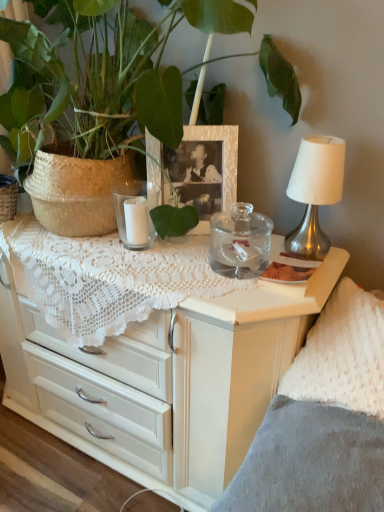
What is the approximate width of white lace chest of drawers at upper center?

The width of white lace chest of drawers at upper center is 19.21 inches.

Where is `green woven basket at upper left`? green woven basket at upper left is located at coordinates (102, 74).

This screenshot has height=512, width=384. I want to click on silver metallic table lamp at upper right, so click(315, 192).

This screenshot has height=512, width=384. Describe the element at coordinates (196, 170) in the screenshot. I see `white textured picture frame at center` at that location.

Where is `transparent glass jar at center, positioned as the 1th candle holder in right-to-left order`? The image size is (384, 512). transparent glass jar at center, positioned as the 1th candle holder in right-to-left order is located at coordinates (239, 241).

Is white glass candle at center, placed as the second candle holder when sorted from right to left, further to camera compared to white textured picture frame at center?

No, white glass candle at center, placed as the second candle holder when sorted from right to left, is closer to the viewer.

From a real-world perspective, is white glass candle at center, placed as the second candle holder when sorted from right to left, located higher than white textured picture frame at center?

No.

Looking at this image, which object is positioned more to the left, white glass candle at center, placed as the second candle holder when sorted from right to left, or white textured picture frame at center?

white glass candle at center, placed as the second candle holder when sorted from right to left.

Is white textured picture frame at center at the back of white glass candle at center, acting as the 1th candle holder starting from the left?

Absolutely, white glass candle at center, acting as the 1th candle holder starting from the left, is directed away from white textured picture frame at center.

In order to click on pillow above the white lace chest of drawers at upper center (from a real-world perspective) in this screenshot , I will do `click(343, 354)`.

Is white lace chest of drawers at upper center aimed at white fluffy pillow at right?

No, white lace chest of drawers at upper center is not turned towards white fluffy pillow at right.

Is white lace chest of drawers at upper center not close to white fluffy pillow at right?

No, white lace chest of drawers at upper center is not far from white fluffy pillow at right.

Would you say gray fabric at lower right is outside white glass candle at center, acting as the 1th candle holder starting from the left?

Indeed, gray fabric at lower right is completely outside white glass candle at center, acting as the 1th candle holder starting from the left.

Considering the positions of point (298, 507) and point (143, 246), is point (298, 507) closer or farther from the camera than point (143, 246)?

Point (298, 507) appears to be closer to the viewer than point (143, 246).

What's the angular difference between gray fabric at lower right and white glass candle at center, placed as the second candle holder when sorted from right to left,'s facing directions?

1.29 degrees.

Would you consider gray fabric at lower right to be distant from white glass candle at center, acting as the 1th candle holder starting from the left?

They are positioned close to each other.

Is white textured picture frame at center next to white glass candle at center, placed as the second candle holder when sorted from right to left, and touching it?

No, white textured picture frame at center is not next to white glass candle at center, placed as the second candle holder when sorted from right to left.

Considering the sizes of white textured picture frame at center and white glass candle at center, acting as the 1th candle holder starting from the left, in the image, is white textured picture frame at center taller or shorter than white glass candle at center, acting as the 1th candle holder starting from the left,?

white textured picture frame at center is taller than white glass candle at center, acting as the 1th candle holder starting from the left.

Consider the image. Measure the distance from white textured picture frame at center to white glass candle at center, placed as the second candle holder when sorted from right to left.

They are 5.84 inches apart.

Is white textured picture frame at center oriented away from white glass candle at center, placed as the second candle holder when sorted from right to left?

No, white textured picture frame at center is not facing the opposite direction of white glass candle at center, placed as the second candle holder when sorted from right to left.

Is transparent glass jar at center, positioned as the 1th candle holder in right-to-left order, aimed at silver metallic table lamp at upper right?

No, transparent glass jar at center, positioned as the 1th candle holder in right-to-left order, is not oriented towards silver metallic table lamp at upper right.

Is transparent glass jar at center, marked as the second candle holder in a left-to-right arrangement, wider or thinner than silver metallic table lamp at upper right?

Clearly, transparent glass jar at center, marked as the second candle holder in a left-to-right arrangement, has more width compared to silver metallic table lamp at upper right.

Is point (259, 244) more distant than point (321, 255)?

Yes, it is.

Would you say silver metallic table lamp at upper right is part of transparent glass jar at center, positioned as the 1th candle holder in right-to-left order,'s contents?

No, transparent glass jar at center, positioned as the 1th candle holder in right-to-left order, does not contain silver metallic table lamp at upper right.

Does white fluffy pillow at right have a greater width compared to white lace chest of drawers at upper center?

No.

Which of these two, white fluffy pillow at right or white lace chest of drawers at upper center, stands taller?

white lace chest of drawers at upper center is taller.

Is white fluffy pillow at right far from white lace chest of drawers at upper center?

white fluffy pillow at right is actually quite close to white lace chest of drawers at upper center.

Between silver metallic table lamp at upper right and gray fabric at lower right, which one has smaller size?

With smaller size is silver metallic table lamp at upper right.

Based on the photo, from the image's perspective, is silver metallic table lamp at upper right on gray fabric at lower right?

Yes.

Could you tell me if silver metallic table lamp at upper right is turned towards gray fabric at lower right?

No, silver metallic table lamp at upper right is not aimed at gray fabric at lower right.

In the scene shown: Between silver metallic table lamp at upper right and gray fabric at lower right, which one has larger width?

gray fabric at lower right is wider.

Where is `picture frame located behind the white glass candle at center, placed as the second candle holder when sorted from right to left`? The width and height of the screenshot is (384, 512). picture frame located behind the white glass candle at center, placed as the second candle holder when sorted from right to left is located at coordinates (196, 170).

At what (x,y) coordinates should I click in order to perform the action: click on chest of drawers above the white fluffy pillow at right (from the image's perspective). Please return your answer as a coordinate pair (x, y). The height and width of the screenshot is (512, 384). Looking at the image, I should click on (162, 379).

Which object lies further to the anchor point white fluffy pillow at right, white textured picture frame at center or white lace chest of drawers at upper center?

white textured picture frame at center is further to white fluffy pillow at right.

Considering their positions, is transparent glass jar at center, positioned as the 1th candle holder in right-to-left order, positioned closer to silver metallic table lamp at upper right than green woven basket at upper left?

transparent glass jar at center, positioned as the 1th candle holder in right-to-left order, is closer to silver metallic table lamp at upper right.

Which object lies nearer to the anchor point white glass candle at center, acting as the 1th candle holder starting from the left, green woven basket at upper left or white textured picture frame at center?

The object closer to white glass candle at center, acting as the 1th candle holder starting from the left, is white textured picture frame at center.

Which object lies nearer to the anchor point transparent glass jar at center, positioned as the 1th candle holder in right-to-left order, green woven basket at upper left or white glass candle at center, placed as the second candle holder when sorted from right to left?

Based on the image, white glass candle at center, placed as the second candle holder when sorted from right to left, appears to be nearer to transparent glass jar at center, positioned as the 1th candle holder in right-to-left order.

When comparing their distances from green woven basket at upper left, does white textured picture frame at center or transparent glass jar at center, positioned as the 1th candle holder in right-to-left order, seem further?

Based on the image, transparent glass jar at center, positioned as the 1th candle holder in right-to-left order, appears to be further to green woven basket at upper left.

When comparing their distances from white lace chest of drawers at upper center, does white glass candle at center, placed as the second candle holder when sorted from right to left, or white textured picture frame at center seem closer?

Among the two, white textured picture frame at center is located nearer to white lace chest of drawers at upper center.

Which object lies further to the anchor point white textured picture frame at center, silver metallic table lamp at upper right or white lace chest of drawers at upper center?

Based on the image, white lace chest of drawers at upper center appears to be further to white textured picture frame at center.

Looking at the image, which one is located further to white textured picture frame at center, transparent glass jar at center, positioned as the 1th candle holder in right-to-left order, or green woven basket at upper left?

green woven basket at upper left.

Where is `the chest of drawers between silver metallic table lamp at upper right and gray fabric at lower right vertically`? The image size is (384, 512). the chest of drawers between silver metallic table lamp at upper right and gray fabric at lower right vertically is located at coordinates (162, 379).

The image size is (384, 512). I want to click on chest of drawers between white glass candle at center, acting as the 1th candle holder starting from the left, and gray fabric at lower right in the up-down direction, so click(162, 379).

Locate an element on the screen. table lamp between white textured picture frame at center and white fluffy pillow at right in the vertical direction is located at coordinates (315, 192).

Locate an element on the screen. candle holder between white textured picture frame at center and silver metallic table lamp at upper right is located at coordinates (239, 241).